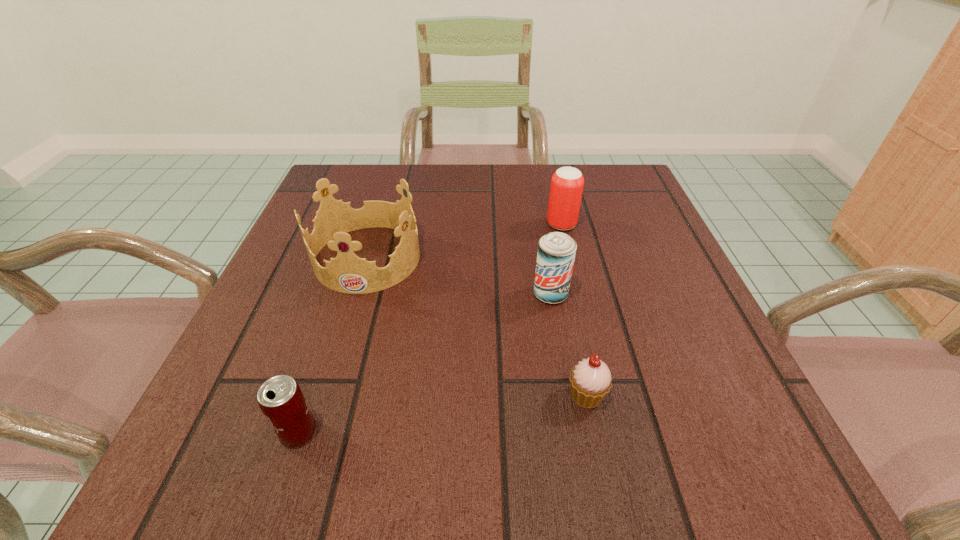
Where is `vacant space located 0.120m on the right of the fourth farthest object`? vacant space located 0.120m on the right of the fourth farthest object is located at coordinates (689, 395).

The height and width of the screenshot is (540, 960). I want to click on object located in the far edge section of the desktop, so click(567, 183).

Where is `object located in the near edge section of the desktop`? Image resolution: width=960 pixels, height=540 pixels. object located in the near edge section of the desktop is located at coordinates (281, 400).

The image size is (960, 540). Find the location of `tiara that is at the left edge`. tiara that is at the left edge is located at coordinates (347, 273).

The image size is (960, 540). I want to click on beer can situated at the left edge, so click(281, 400).

This screenshot has height=540, width=960. Find the location of `object positioned at the near left corner`. object positioned at the near left corner is located at coordinates (281, 400).

The height and width of the screenshot is (540, 960). I want to click on vacant area at the far edge of the desktop, so click(534, 165).

The width and height of the screenshot is (960, 540). In order to click on vacant space at the near edge of the desktop in this screenshot , I will do `click(519, 428)`.

This screenshot has height=540, width=960. In order to click on free space at the left edge of the desktop in this screenshot , I will do `click(319, 287)`.

Locate an element on the screen. vacant region at the right edge of the desktop is located at coordinates (684, 367).